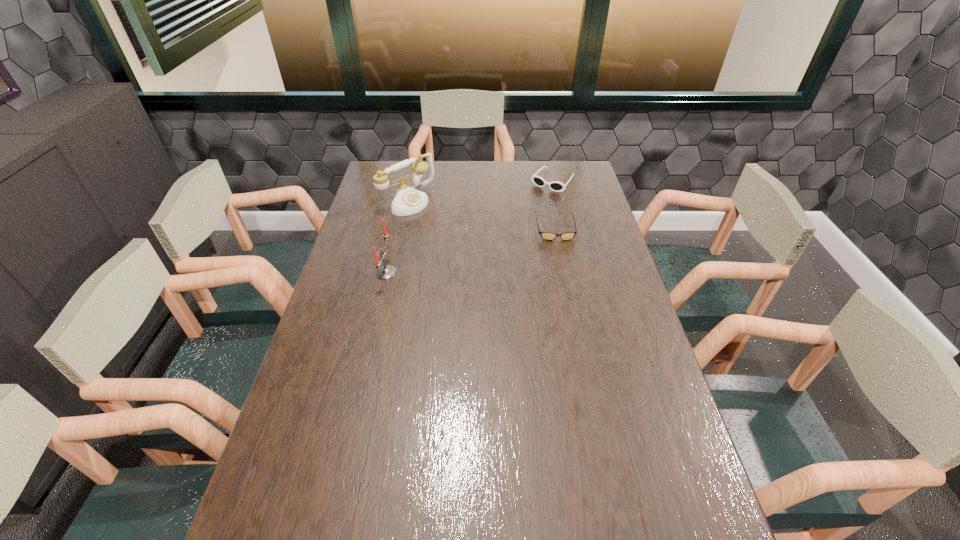
What are the coordinates of `vacant space on the desktop that is between the nearest object and the shorter sunglasses and is positioned on the dial of the telephone` in the screenshot? It's located at (479, 249).

Where is `free space on the desktop that is between the candle and the shorter sunglasses and is positioned with the lenses of the third tallest object facing outward`? free space on the desktop that is between the candle and the shorter sunglasses and is positioned with the lenses of the third tallest object facing outward is located at coordinates pyautogui.click(x=499, y=244).